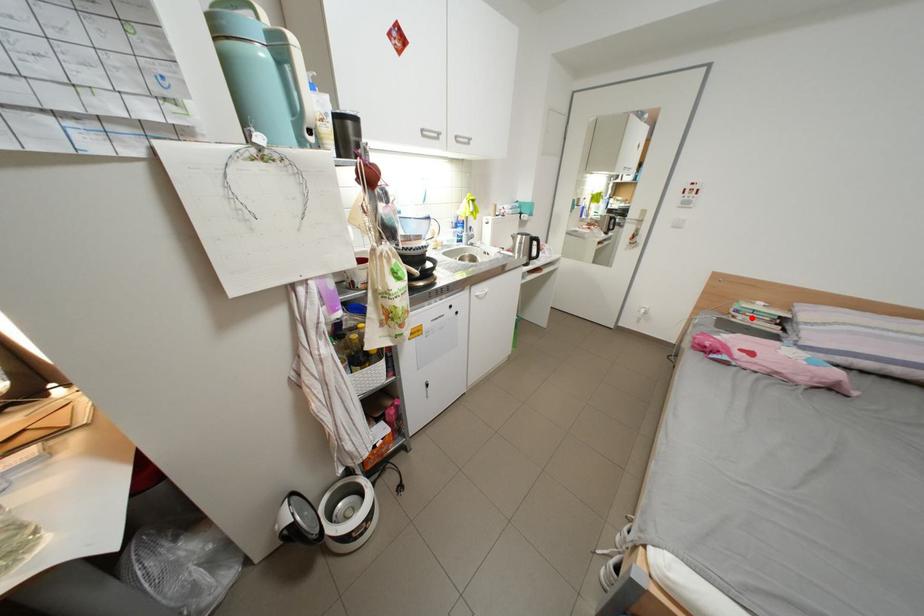
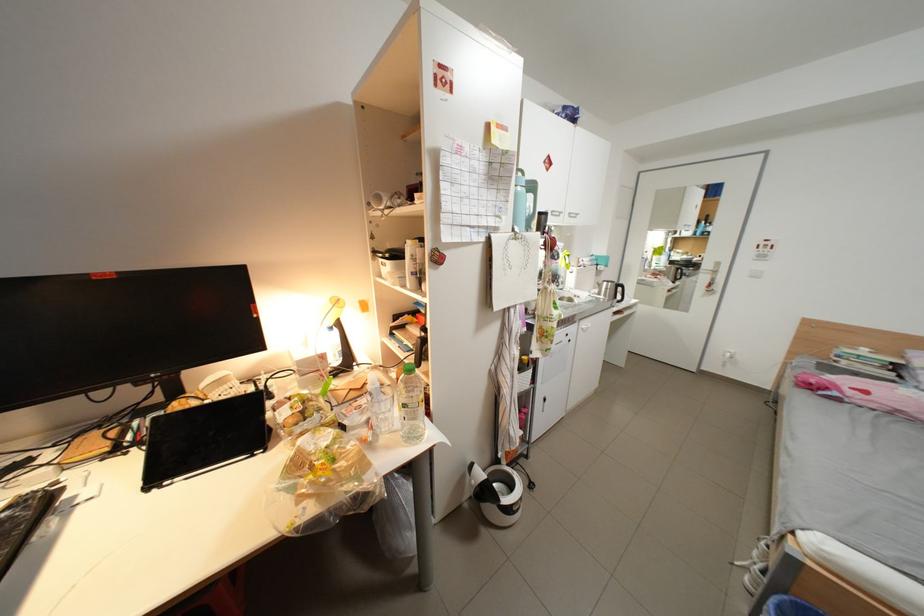
In the second image, find the point that corresponds to the highlighted location in the first image.

(856, 363)